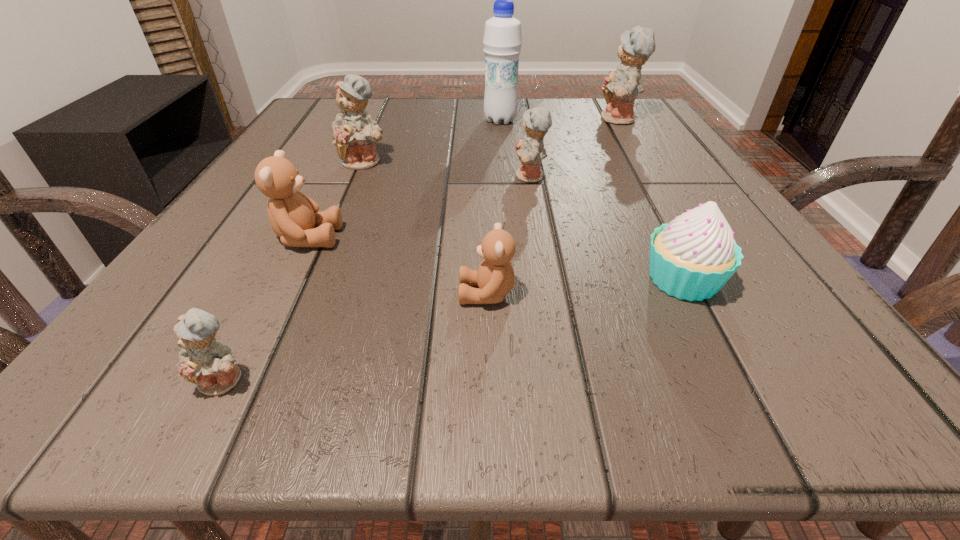
Image resolution: width=960 pixels, height=540 pixels. What are the coordinates of `blue water bottle` in the screenshot? It's located at (502, 41).

I want to click on the tallest object, so click(x=502, y=41).

Identify the location of the rightmost teddy bear. This screenshot has height=540, width=960. (620, 88).

Identify the location of the seventh shortest object. The height and width of the screenshot is (540, 960). (620, 88).

Find the location of a particular element. Image resolution: width=960 pixels, height=540 pixels. the third smallest blue teddy bear is located at coordinates (355, 133).

In order to click on the second tallest teddy bear in this screenshot , I will do `click(355, 133)`.

This screenshot has width=960, height=540. I want to click on the third biggest blue teddy bear, so coord(530,150).

The width and height of the screenshot is (960, 540). I want to click on the fifth teddy bear from left to right, so click(x=530, y=150).

Locate an element on the screen. Image resolution: width=960 pixels, height=540 pixels. the farther brown teddy bear is located at coordinates (294, 217).

This screenshot has width=960, height=540. Identify the location of the left brown teddy bear. (294, 217).